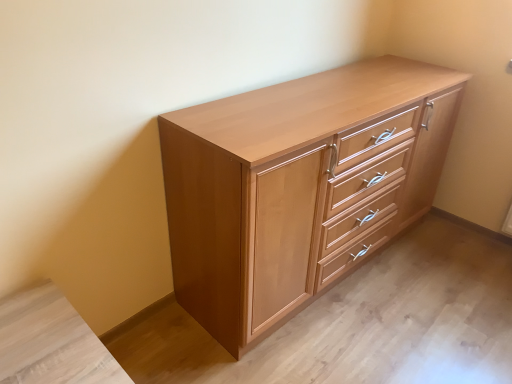
Find the location of a particular element. Image resolution: width=512 pixels, height=384 pixels. vacant area on top of light brown wood vanity at lower left (from a real-world perspective) is located at coordinates (45, 340).